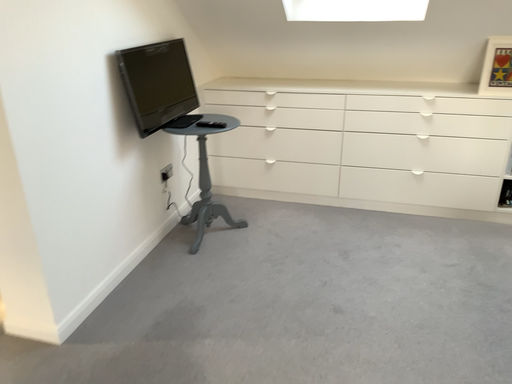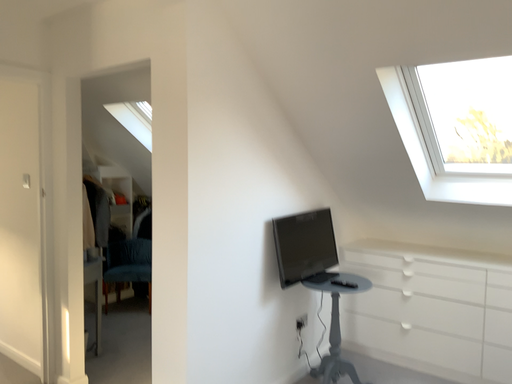
Question: Which way did the camera rotate in the video?

Choices:
 (A) rotated upward
 (B) rotated downward

Answer: (A)